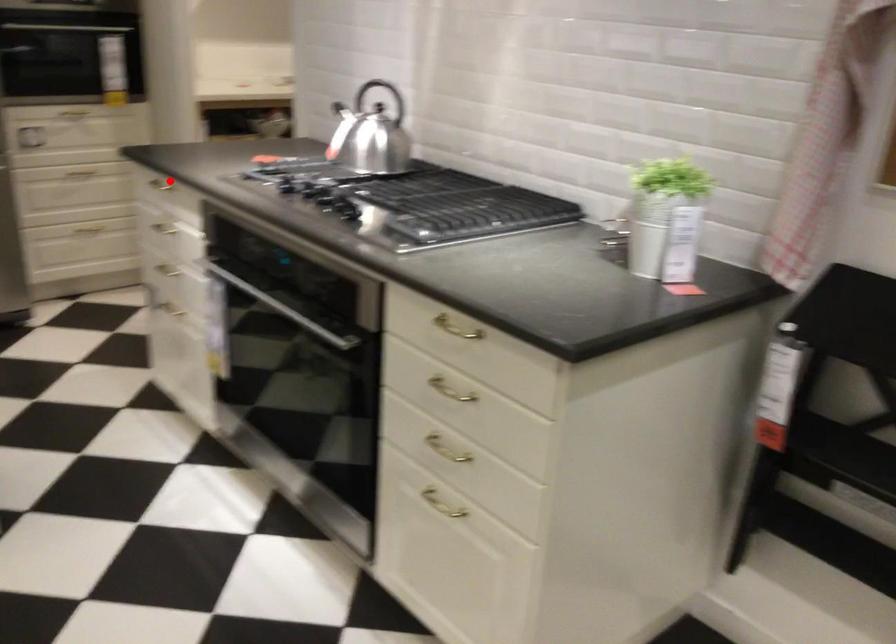
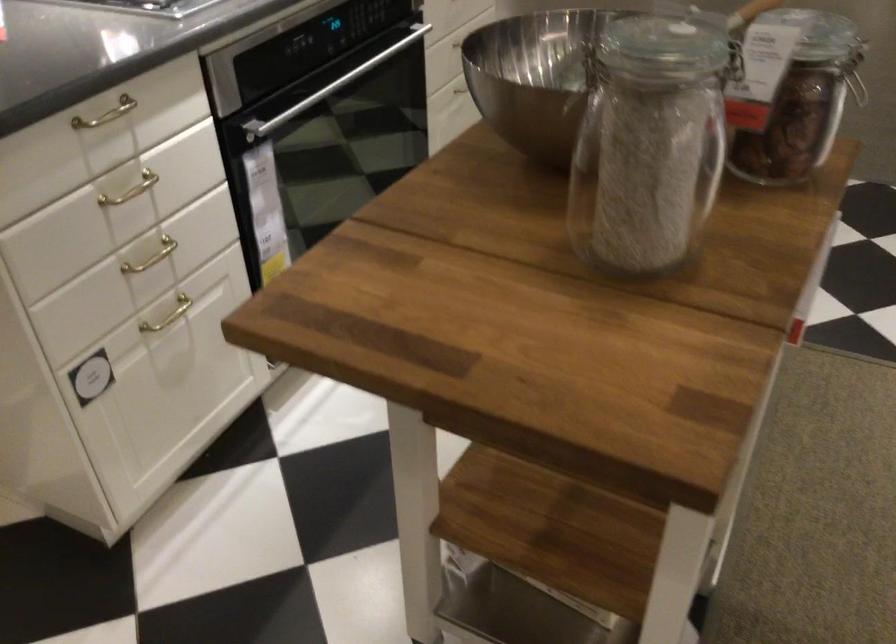
In the second image, find the point that corresponds to the highlighted location in the first image.

(106, 114)